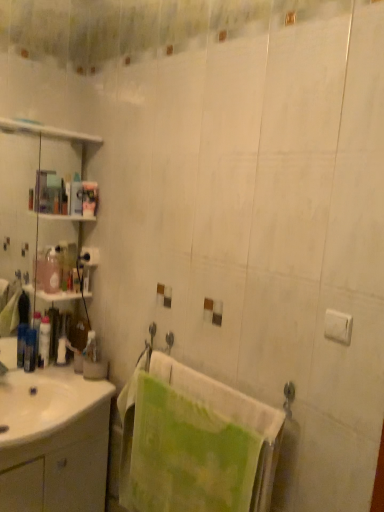
Find the location of `matte silver faucet at sink left`. matte silver faucet at sink left is located at coordinates (5, 368).

How much space does translucent plastic bottle at left, the 5th toiletry positioned from the right, occupy vertically?

translucent plastic bottle at left, the 5th toiletry positioned from the right, is 7.19 inches in height.

Describe the element at coordinates (30, 350) in the screenshot. I see `translucent plastic bottle at left, the 1th toiletry from the left` at that location.

This screenshot has width=384, height=512. What do you see at coordinates (40, 157) in the screenshot?
I see `translucent plastic shelves at left` at bounding box center [40, 157].

What is the approximate width of white glossy cabinet at lower left?

The width of white glossy cabinet at lower left is 18.05 inches.

The width and height of the screenshot is (384, 512). I want to click on white matte toilet paper at upper left, so click(x=90, y=256).

What is the approximate width of white glossy lotion at left, marked as the 2th toiletry in a left-to-right arrangement?

2.94 inches.

Identify the location of matte silver faucet at sink left. point(5,368).

Does matte silver faucet at sink left have a lesser width compared to translucent plastic bottle at left, the 5th toiletry positioned from the right?

In fact, matte silver faucet at sink left might be wider than translucent plastic bottle at left, the 5th toiletry positioned from the right.

Does matte silver faucet at sink left have a lesser height compared to translucent plastic bottle at left, the 5th toiletry positioned from the right?

Correct, matte silver faucet at sink left is not as tall as translucent plastic bottle at left, the 5th toiletry positioned from the right.

From the image's perspective, is translucent plastic bottle at left, acting as the first toiletry starting from the right, positioned above or below white matte toilet paper at upper left?

Based on their image positions, translucent plastic bottle at left, acting as the first toiletry starting from the right, is located beneath white matte toilet paper at upper left.

Locate an element on the screen. This screenshot has width=384, height=512. toilet paper on the left of translucent plastic bottle at left, acting as the first toiletry starting from the right is located at coordinates (90, 256).

Is translucent plastic bottle at left, which is counted as the 5th toiletry, starting from the left, spatially inside white matte toilet paper at upper left, or outside of it?

The correct answer is: outside.

What's the angular difference between white glossy lotion at left, marked as the 2th toiletry in a left-to-right arrangement, and translucent plastic bottle at left, the 5th toiletry positioned from the right,'s facing directions?

The angular difference between white glossy lotion at left, marked as the 2th toiletry in a left-to-right arrangement, and translucent plastic bottle at left, the 5th toiletry positioned from the right, is 0.0037 degrees.

Could you tell me if white glossy lotion at left, marked as the 2th toiletry in a left-to-right arrangement, is turned towards translucent plastic bottle at left, the 5th toiletry positioned from the right?

No, white glossy lotion at left, marked as the 2th toiletry in a left-to-right arrangement, is not oriented towards translucent plastic bottle at left, the 5th toiletry positioned from the right.

In the scene shown: Considering the relative sizes of white glossy lotion at left, which is the 4th toiletry in right-to-left order, and translucent plastic bottle at left, the 1th toiletry from the left, in the image provided, is white glossy lotion at left, which is the 4th toiletry in right-to-left order, bigger than translucent plastic bottle at left, the 1th toiletry from the left,?

Yes.

From the image's perspective, is matte silver faucet at sink left beneath white matte toilet paper at upper left?

Indeed, from the image's perspective, matte silver faucet at sink left is shown beneath white matte toilet paper at upper left.

In terms of size, does matte silver faucet at sink left appear bigger or smaller than white matte toilet paper at upper left?

In the image, matte silver faucet at sink left appears to be larger than white matte toilet paper at upper left.

From a real-world perspective, relative to white plastic bottle at left, marked as the 2th toiletry in a right-to-left arrangement, is white matte toilet paper at upper left vertically above or below?

In terms of real-world spatial position, white matte toilet paper at upper left is above white plastic bottle at left, marked as the 2th toiletry in a right-to-left arrangement.

Are white matte toilet paper at upper left and white plastic bottle at left, marked as the 2th toiletry in a right-to-left arrangement, located far from each other?

No, white matte toilet paper at upper left is not far away from white plastic bottle at left, marked as the 2th toiletry in a right-to-left arrangement.

From the image's perspective, who appears lower, white matte toilet paper at upper left or white plastic bottle at left, marked as the 2th toiletry in a right-to-left arrangement?

white plastic bottle at left, marked as the 2th toiletry in a right-to-left arrangement, is shown below in the image.

Is point (130, 470) closer or farther from the camera than point (43, 282)?

Clearly, point (130, 470) is closer to the camera than point (43, 282).

Is green textured towel at center inside or outside of pink glossy bottle at left, placed as the third toiletry when sorted from right to left?

The correct answer is: outside.

Consider the image. Is green textured towel at center shorter than pink glossy bottle at left, placed as the third toiletry when sorted from right to left?

No, green textured towel at center is not shorter than pink glossy bottle at left, placed as the third toiletry when sorted from right to left.

Is green textured towel at center bigger than pink glossy bottle at left, placed as the third toiletry when sorted from right to left?

Yes, green textured towel at center is bigger than pink glossy bottle at left, placed as the third toiletry when sorted from right to left.

Can you tell me how much white plastic bottle at left, marked as the 2th toiletry in a right-to-left arrangement, and translucent plastic bottle at left, which is counted as the 5th toiletry, starting from the left, differ in facing direction?

They differ by 23.1 degrees in their facing directions.

Considering the sizes of objects white plastic bottle at left, marked as the 2th toiletry in a right-to-left arrangement, and translucent plastic bottle at left, acting as the first toiletry starting from the right, in the image provided, who is smaller, white plastic bottle at left, marked as the 2th toiletry in a right-to-left arrangement, or translucent plastic bottle at left, acting as the first toiletry starting from the right,?

translucent plastic bottle at left, acting as the first toiletry starting from the right, is smaller.

Between white plastic bottle at left, marked as the 2th toiletry in a right-to-left arrangement, and translucent plastic bottle at left, which is counted as the 5th toiletry, starting from the left, which one appears on the right side from the viewer's perspective?

translucent plastic bottle at left, which is counted as the 5th toiletry, starting from the left, is more to the right.

Image resolution: width=384 pixels, height=512 pixels. I want to click on toiletry that is the 2nd object located above the matte silver faucet at sink left (from the image's perspective), so click(x=30, y=350).

From the white matte toilet paper at upper left, count 1st toiletrys backward and point to it. Please provide its 2D coordinates.

[(90, 346)]

When comparing their distances from white plastic bottle at left, marked as the 2th toiletry in a right-to-left arrangement, does translucent plastic bottle at left, the 5th toiletry positioned from the right, or matte silver faucet at sink left seem further?

matte silver faucet at sink left.

Considering their positions, is translucent plastic bottle at left, the 5th toiletry positioned from the right, positioned further to translucent plastic shelves at left than white glossy lotion at left, marked as the 2th toiletry in a left-to-right arrangement?

translucent plastic bottle at left, the 5th toiletry positioned from the right.

When comparing their distances from translucent plastic bottle at left, the 5th toiletry positioned from the right, does translucent plastic bottle at left, acting as the first toiletry starting from the right, or white glossy lotion at left, which is the 4th toiletry in right-to-left order, seem closer?

white glossy lotion at left, which is the 4th toiletry in right-to-left order, lies closer to translucent plastic bottle at left, the 5th toiletry positioned from the right, than the other object.

Estimate the real-world distances between objects in this image. Which object is further from white plastic bottle at left, marked as the 2th toiletry in a right-to-left arrangement, white glossy cabinet at lower left or white matte toilet paper at upper left?

white glossy cabinet at lower left.

Looking at the image, which one is located closer to translucent plastic shelves at left, translucent plastic bottle at left, the 5th toiletry positioned from the right, or white matte toilet paper at upper left?

A: white matte toilet paper at upper left is positioned closer to the anchor translucent plastic shelves at left.

Considering their positions, is translucent plastic bottle at left, the 1th toiletry from the left, positioned closer to pink glossy bottle at left, placed as the third toiletry when sorted from right to left, than white plastic bottle at left, arranged as the 4th toiletry when viewed from the left?

white plastic bottle at left, arranged as the 4th toiletry when viewed from the left, is closer to pink glossy bottle at left, placed as the third toiletry when sorted from right to left.

Considering their positions, is translucent plastic shelves at left positioned closer to white glossy lotion at left, which is the 4th toiletry in right-to-left order, than matte silver faucet at sink left?

Based on the image, matte silver faucet at sink left appears to be nearer to white glossy lotion at left, which is the 4th toiletry in right-to-left order.

Which object lies nearer to the anchor point green textured towel at center, translucent plastic shelves at left or matte silver faucet at sink left?

The object closer to green textured towel at center is matte silver faucet at sink left.

The image size is (384, 512). I want to click on shelf between green textured towel at center and translucent plastic bottle at left, which is counted as the 5th toiletry, starting from the left, along the z-axis, so click(40, 157).

Image resolution: width=384 pixels, height=512 pixels. In order to click on toiletry that lies between pink glossy bottle at left, marked as the 3th toiletry in a left-to-right arrangement, and white glossy lotion at left, which is the 4th toiletry in right-to-left order, from top to bottom in this screenshot , I will do `click(62, 343)`.

Find the location of a particular element. The image size is (384, 512). faucet between translucent plastic bottle at left, the 1th toiletry from the left, and white glossy cabinet at lower left vertically is located at coordinates (5, 368).

Where is `toiletry between translucent plastic shelves at left and white plastic bottle at left, marked as the 2th toiletry in a right-to-left arrangement, in the up-down direction`? The image size is (384, 512). toiletry between translucent plastic shelves at left and white plastic bottle at left, marked as the 2th toiletry in a right-to-left arrangement, in the up-down direction is located at coordinates (51, 272).